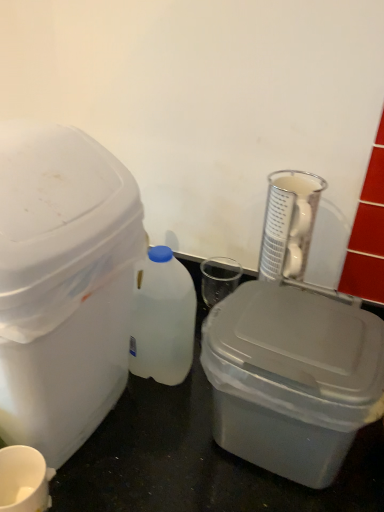
The height and width of the screenshot is (512, 384). I want to click on free space above gray plastic storage box at center, which is counted as the 1th storage box, starting from the right (from a real-world perspective), so click(x=296, y=333).